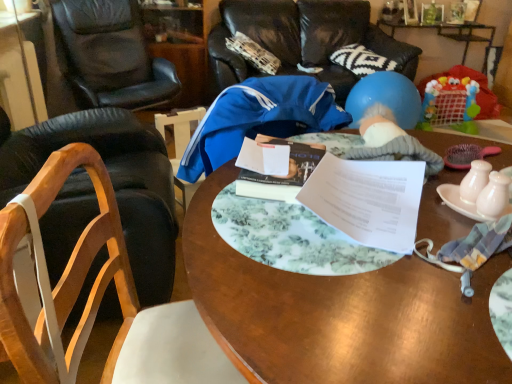
Find the location of `free space in front of white paper at center`. free space in front of white paper at center is located at coordinates (392, 308).